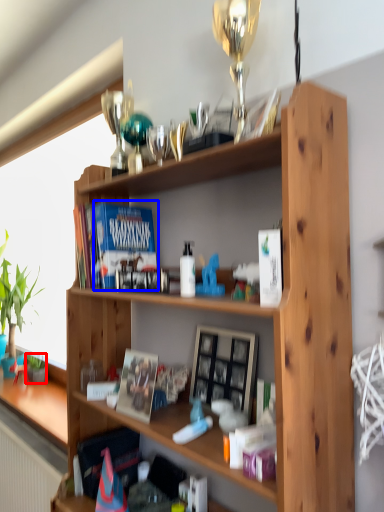
Question: Which point is closer to the camera, houseplant (highlighted by a red box) or paperback book (highlighted by a blue box)?

Choices:
 (A) houseplant
 (B) paperback book

Answer: (B)